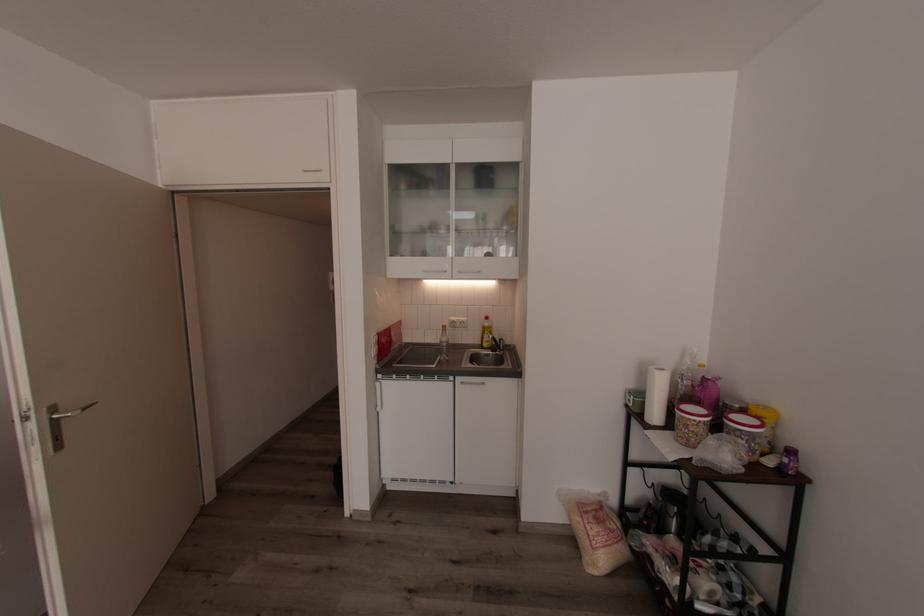
Where is `paper towel roll`? This screenshot has width=924, height=616. paper towel roll is located at coordinates (657, 395).